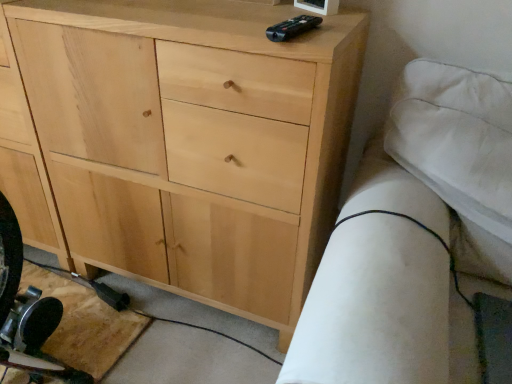
This screenshot has width=512, height=384. Find the location of `natural wood cabinet at center`. natural wood cabinet at center is located at coordinates (192, 142).

Describe the element at coordinates (192, 142) in the screenshot. This screenshot has height=384, width=512. I see `natural wood cabinet at center` at that location.

Where is `natural wood cabinet at center`? This screenshot has height=384, width=512. natural wood cabinet at center is located at coordinates (192, 142).